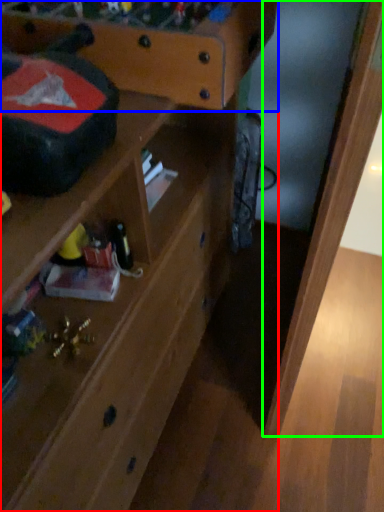
Question: Considering the real-world distances, which object is farthest from shelf (highlighted by a red box)? writing desk (highlighted by a blue box) or wood (highlighted by a green box)?

Choices:
 (A) writing desk
 (B) wood

Answer: (B)